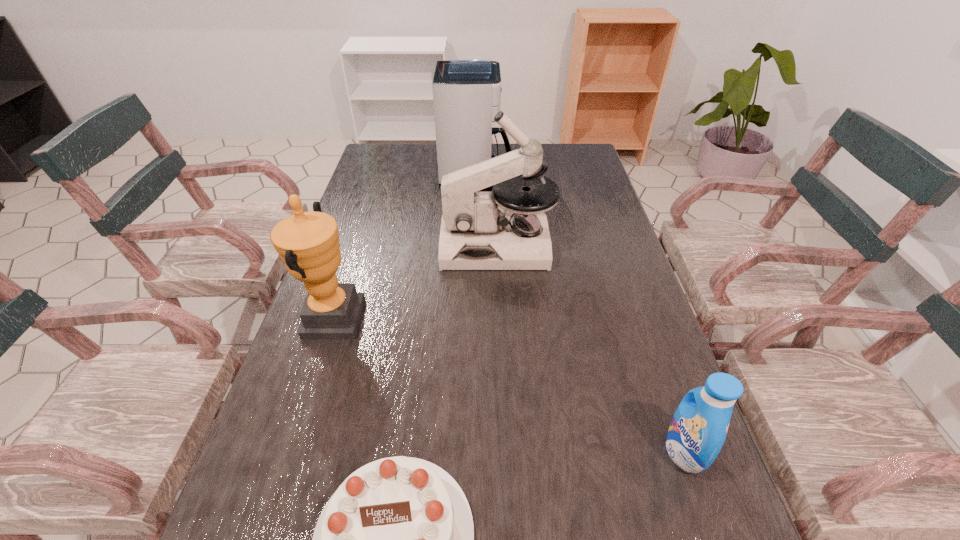
This screenshot has height=540, width=960. What are the coordinates of `free region located 0.070m at the front of the third nearest object with handles` in the screenshot? It's located at point(390,319).

Find the location of `free space located on the front-facing side of the detergent`. free space located on the front-facing side of the detergent is located at coordinates (450, 451).

Locate an element on the screen. This screenshot has height=540, width=960. free space located 0.070m on the front-facing side of the detergent is located at coordinates (630, 451).

Locate an element on the screen. The width and height of the screenshot is (960, 540). vacant space located on the front-facing side of the detergent is located at coordinates (521, 451).

This screenshot has height=540, width=960. Identify the location of object at the far edge. (466, 92).

Image resolution: width=960 pixels, height=540 pixels. What are the coordinates of `object present at the left edge` in the screenshot? It's located at (307, 242).

This screenshot has height=540, width=960. What are the coordinates of `object that is at the right edge` in the screenshot? It's located at (698, 429).

This screenshot has width=960, height=540. In the image, there is a desktop. In order to click on vacant space at the far edge in this screenshot , I will do `click(437, 171)`.

Where is `vacant region at the left edge`? The width and height of the screenshot is (960, 540). vacant region at the left edge is located at coordinates point(382,212).

The width and height of the screenshot is (960, 540). In the image, there is a desktop. Identify the location of vacant space at the right edge. (589, 246).